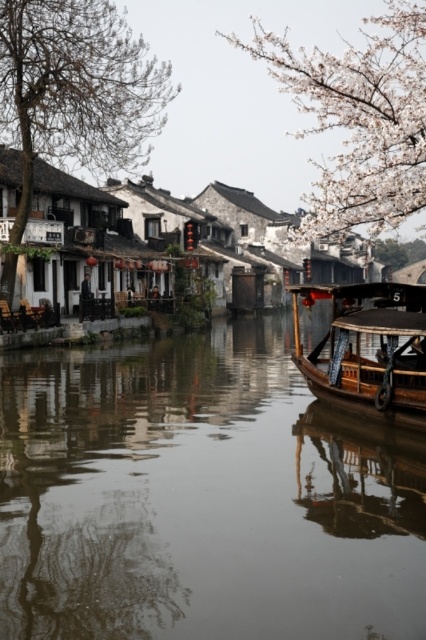
You are standing at the edge of the canal and want to take a photo that includes both the smooth brown water at center and the wooden boat at right. Which object should you focus on first to ensure both are in the frame?

You should focus on the smooth brown water at center first since it is closer to you than the wooden boat at right, ensuring both are in the frame by adjusting the camera angle accordingly.

You are an artist planning to paint the scene. You notice the bare branches at left and the white blossoming branches at upper right. Which of these two elements should you depict as larger in your painting to accurately represent their sizes in the image?

You should depict the white blossoming branches at upper right as larger in your painting because the bare branches at left is smaller than white blossoming branches at upper right according to the description.